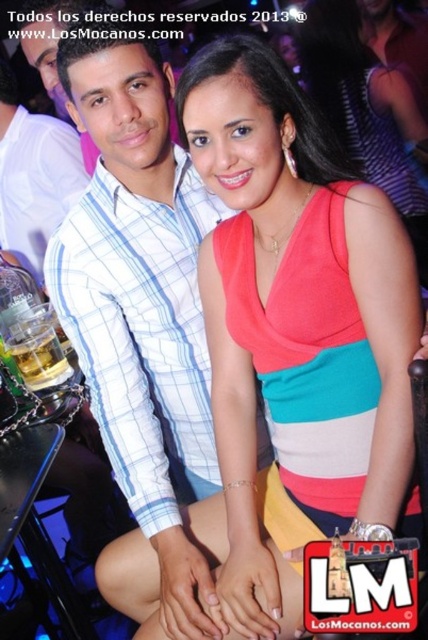
Question: Does matte plaid shirt at left come in front of translucent glass beer at lower left?

Choices:
 (A) yes
 (B) no

Answer: (B)

Question: Observing the image, what is the correct spatial positioning of matte pink dress at center in reference to translucent glass beer at lower left?

Choices:
 (A) above
 (B) below

Answer: (B)

Question: Can you confirm if matte pink dress at center is wider than white checkered shirt at center?

Choices:
 (A) yes
 (B) no

Answer: (A)

Question: Which point is farther from the camera taking this photo?

Choices:
 (A) (303, 513)
 (B) (70, 369)
 (C) (71, 72)
 (D) (8, 196)

Answer: (D)

Question: Among these objects, which one is farthest from the camera?

Choices:
 (A) white checkered shirt at center
 (B) translucent glass beer at lower left
 (C) matte plaid shirt at left
 (D) matte pink dress at center

Answer: (C)

Question: Estimate the real-world distances between objects in this image. Which object is farther from the white checkered shirt at center?

Choices:
 (A) translucent glass beer at lower left
 (B) matte pink dress at center

Answer: (A)